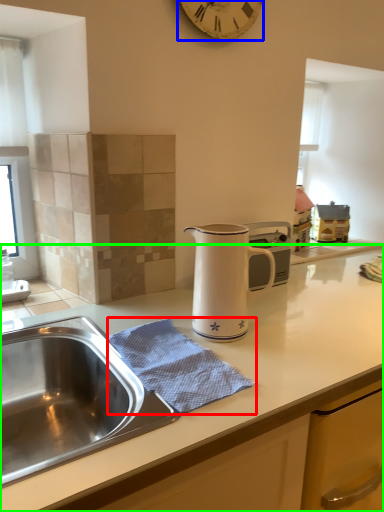
Question: Which is farther away from blanket (highlighted by a red box)? clock (highlighted by a blue box) or countertop (highlighted by a green box)?

Choices:
 (A) clock
 (B) countertop

Answer: (A)